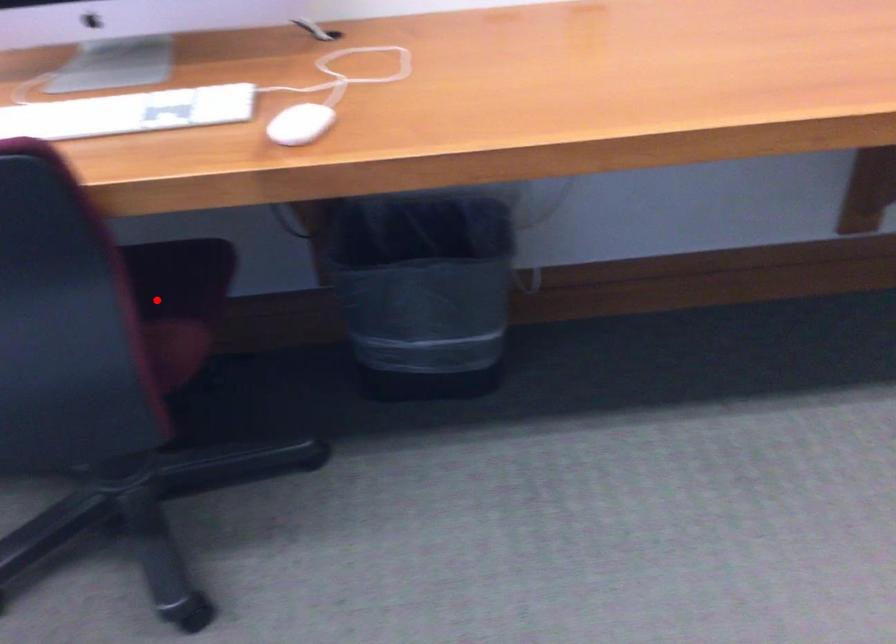
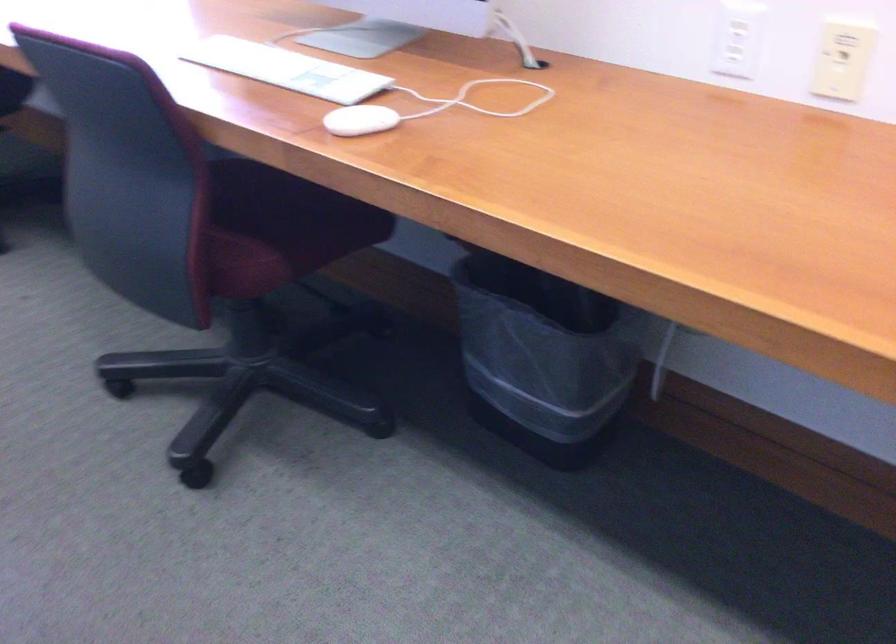
Locate, in the second image, the point that corresponds to the highlighted location in the first image.

(273, 228)